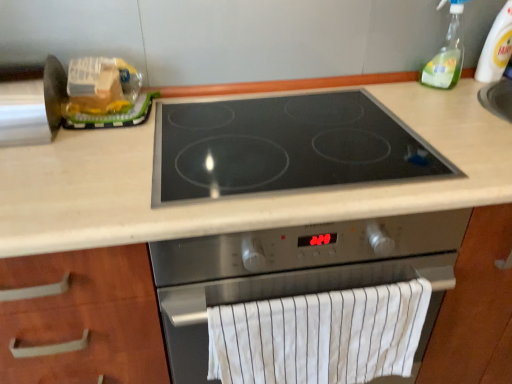
Image resolution: width=512 pixels, height=384 pixels. In order to click on free space on the front side of translucent plastic bag at upper left in this screenshot , I will do `click(106, 142)`.